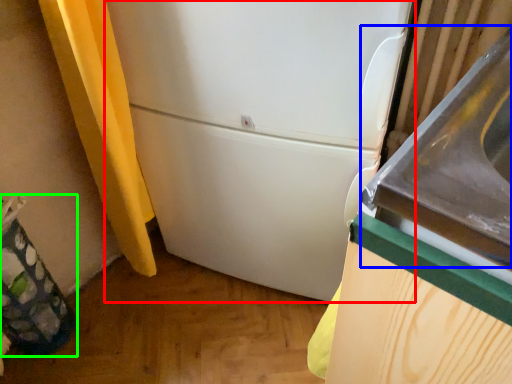
Question: Considering the real-world distances, which object is closest to refrigerator (highlighted by a red box)? sink (highlighted by a blue box) or garbage (highlighted by a green box).

Choices:
 (A) sink
 (B) garbage

Answer: (A)